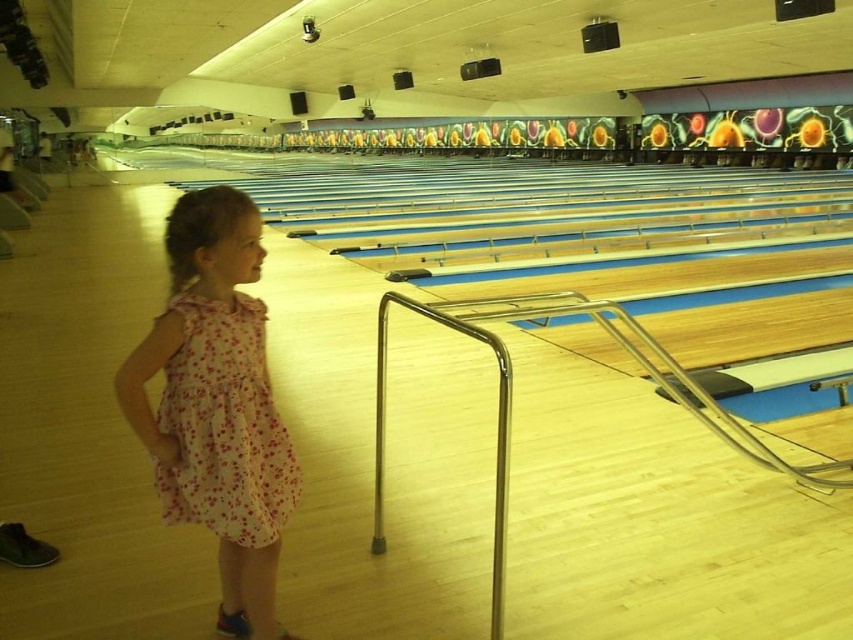
Question: Which of the following is the closest to the observer?

Choices:
 (A) pink floral dress at center
 (B) floral cotton dress at left

Answer: (A)

Question: Is pink floral dress at center positioned before floral cotton dress at left?

Choices:
 (A) no
 (B) yes

Answer: (B)

Question: Where is pink floral dress at center located in relation to floral cotton dress at left in the image?

Choices:
 (A) above
 (B) below

Answer: (B)

Question: Can you confirm if pink floral dress at center is wider than floral cotton dress at left?

Choices:
 (A) yes
 (B) no

Answer: (A)